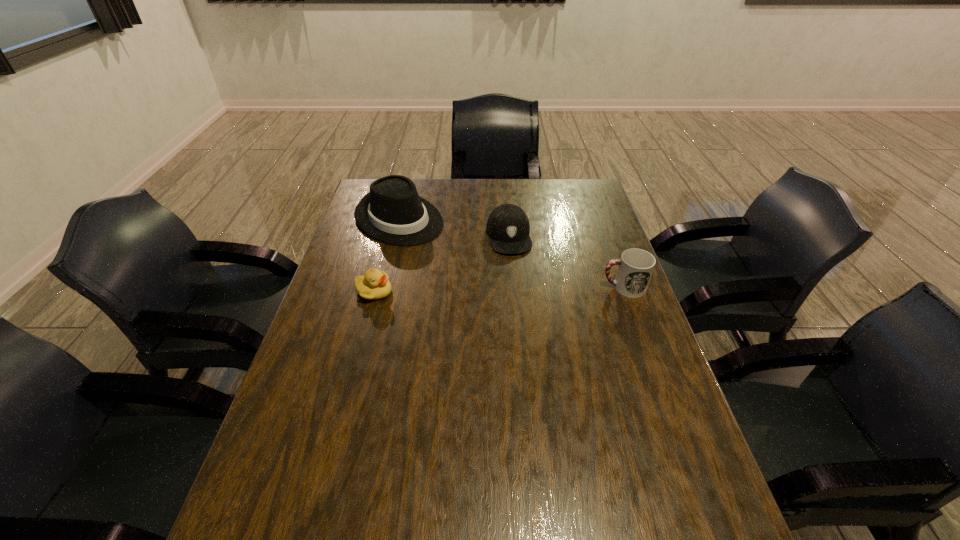
Locate an element on the screen. The image size is (960, 540). vacant area that lies between the cap and the shortest object is located at coordinates (442, 264).

You are a GUI agent. You are given a task and a screenshot of the screen. Output one action in this format:
    pyautogui.click(x=<x>, y=<y>)
    Task: Click on the empty location between the second object from right to left and the cup
    This screenshot has width=960, height=540.
    Given the screenshot: What is the action you would take?
    pyautogui.click(x=566, y=262)

Locate an element on the screen. the closest object to the fedora is located at coordinates (508, 227).

The width and height of the screenshot is (960, 540). In order to click on object that is the second nearest to the shortest object in this screenshot , I will do `click(508, 227)`.

Image resolution: width=960 pixels, height=540 pixels. Identify the location of vacant area that satisfies the following two spatial constraints: 1. on the front side of the second object from right to left; 2. on the side of the rightmost object where the handle is located. (513, 287).

Image resolution: width=960 pixels, height=540 pixels. In order to click on vacant space that satisfies the following two spatial constraints: 1. on the front side of the tallest object; 2. on the right side of the third object from left to right in this screenshot , I will do `click(395, 237)`.